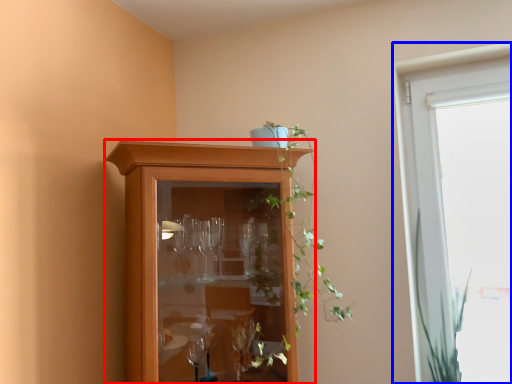
Question: Which point is further to the camera, cupboard (highlighted by a red box) or window (highlighted by a blue box)?

Choices:
 (A) cupboard
 (B) window

Answer: (B)